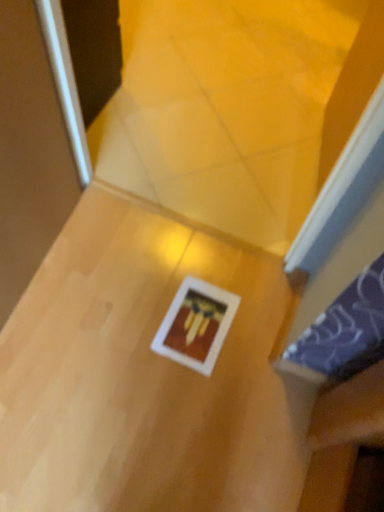
I want to click on free space to the back side of white matte picture frame at center, so click(215, 269).